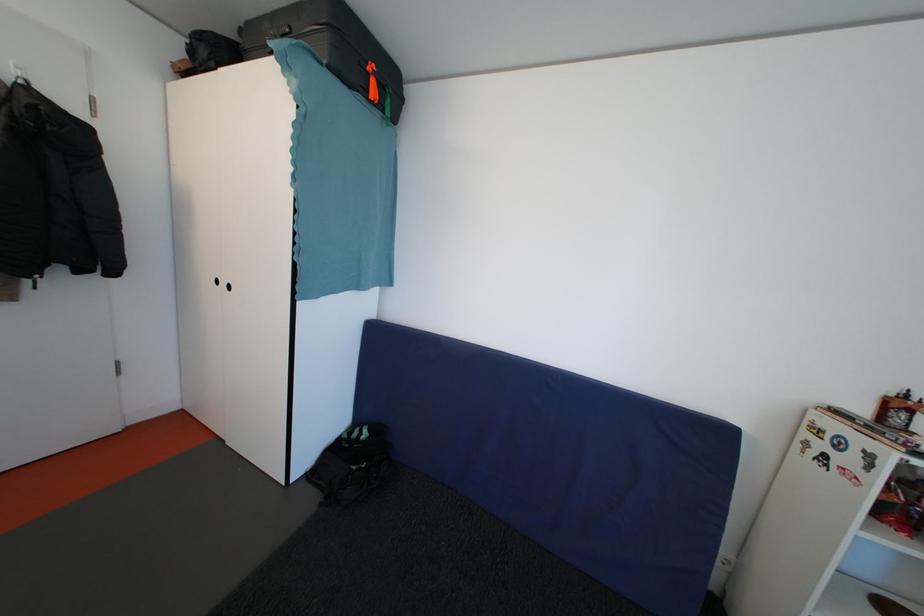
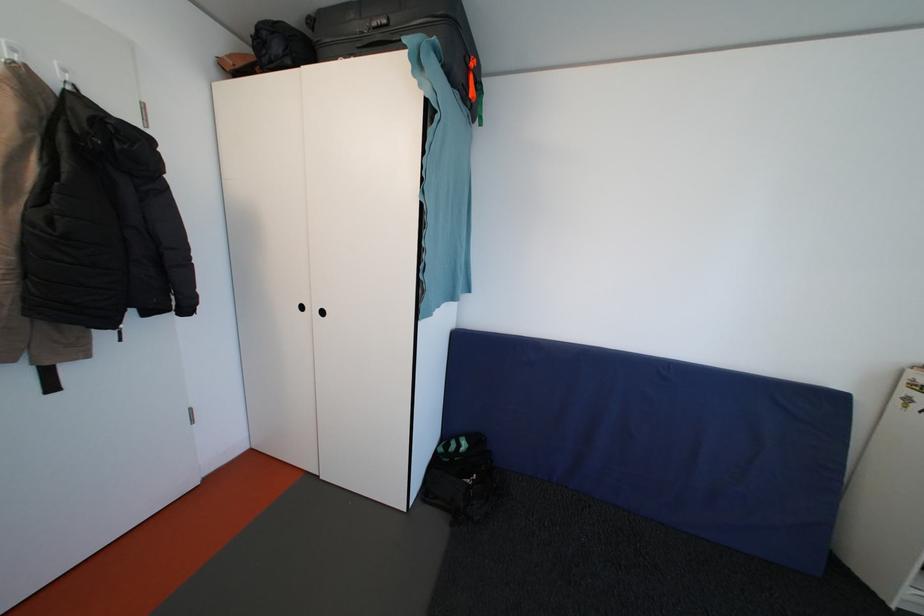
Where in the second image is the point corresponding to (377,74) from the first image?

(479, 70)